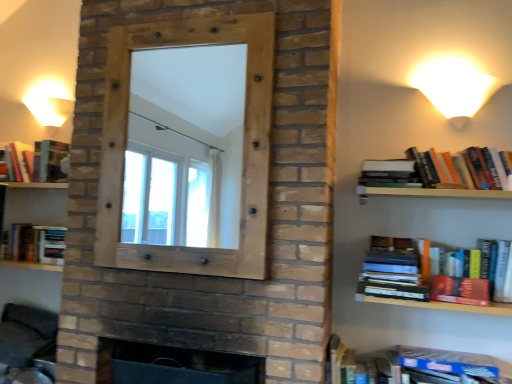
Question: Does hardcover book at upper right, the 3th book positioned from the right, appear on the left side of hardcover book at right?

Choices:
 (A) no
 (B) yes

Answer: (B)

Question: From the image's perspective, is hardcover book at upper right, positioned as the 3th book in top-to-bottom order, under hardcover book at right?

Choices:
 (A) yes
 (B) no

Answer: (B)

Question: Is hardcover book at upper right, positioned as the 3th book in top-to-bottom order, behind hardcover book at right?

Choices:
 (A) no
 (B) yes

Answer: (B)

Question: From the image's perspective, is hardcover book at upper right, positioned as the 3th book in top-to-bottom order, located above hardcover book at right?

Choices:
 (A) no
 (B) yes

Answer: (B)

Question: Is hardcover book at upper right, the 3th book ordered from the bottom, outside of hardcover book at right?

Choices:
 (A) yes
 (B) no

Answer: (A)

Question: Can you confirm if hardcover book at upper right, the 3th book positioned from the right, is bigger than hardcover book at right?

Choices:
 (A) yes
 (B) no

Answer: (B)

Question: Is matte white lampshade at upper left, the 2th table lamp viewed from the right, smaller than dark brick fireplace at center?

Choices:
 (A) no
 (B) yes

Answer: (B)

Question: Could you tell me if matte white lampshade at upper left, the 1th table lamp viewed from the left, is turned towards dark brick fireplace at center?

Choices:
 (A) no
 (B) yes

Answer: (A)

Question: Is dark brick fireplace at center at the back of matte white lampshade at upper left, the 2th table lamp from the front?

Choices:
 (A) yes
 (B) no

Answer: (B)

Question: From the image's perspective, is matte white lampshade at upper left, the 1th table lamp viewed from the left, above dark brick fireplace at center?

Choices:
 (A) yes
 (B) no

Answer: (A)

Question: Can you confirm if matte white lampshade at upper left, the 2th table lamp viewed from the right, is wider than dark brick fireplace at center?

Choices:
 (A) yes
 (B) no

Answer: (B)

Question: Is matte white lampshade at upper left, the 1th table lamp viewed from the left, outside of dark brick fireplace at center?

Choices:
 (A) yes
 (B) no

Answer: (A)

Question: From a real-world perspective, is dark brick fireplace at center below hardcover book at upper right, positioned as the 3th book in left-to-right order?

Choices:
 (A) yes
 (B) no

Answer: (A)